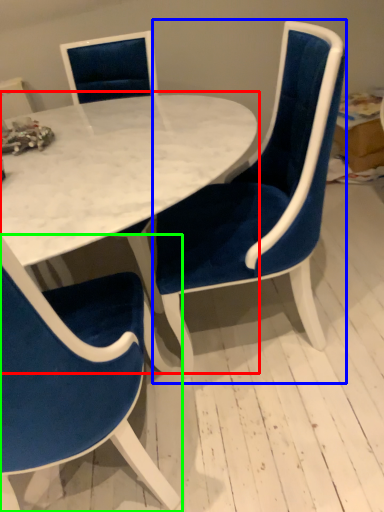
Question: Which object is the farthest from table (highlighted by a red box)? Choose among these: chair (highlighted by a blue box) or chair (highlighted by a green box).

Choices:
 (A) chair
 (B) chair

Answer: (B)